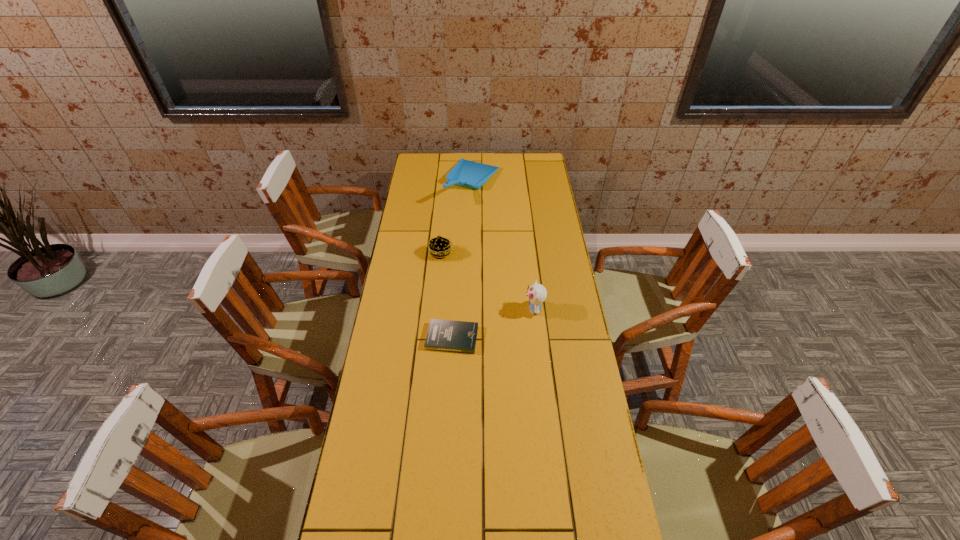
Locate which object ranks second in proximity to the nearest object. Please provide its 2D coordinates. Your answer should be formatted as a tuple, i.e. [(x, y)], where the tuple contains the x and y coordinates of a point satisfying the conditions above.

[(439, 247)]

Identify the location of object that stands as the second closest to the third nearest object. The height and width of the screenshot is (540, 960). (443, 335).

Where is `free spot that satisfies the following two spatial constraints: 1. on the back side of the shortest object; 2. on the right side of the farthest object`? free spot that satisfies the following two spatial constraints: 1. on the back side of the shortest object; 2. on the right side of the farthest object is located at coordinates (461, 183).